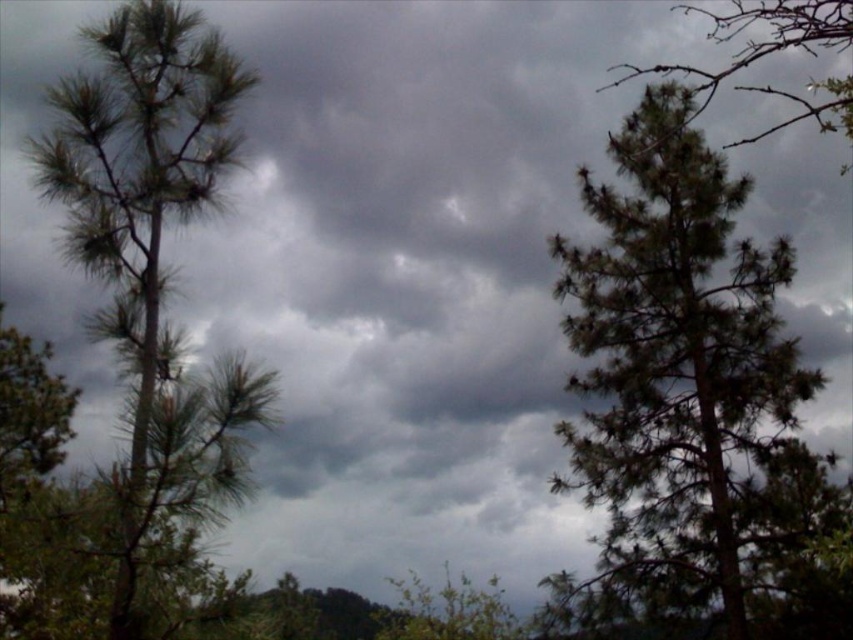
Between green needle-like at left and green needle-like at upper right, which one is positioned lower?

green needle-like at left

Which is behind, point (165, 68) or point (734, 22)?

Positioned behind is point (734, 22).

Describe the element at coordinates (140, 186) in the screenshot. I see `green needle-like at left` at that location.

At what (x,y) coordinates should I click in order to perform the action: click on green needle-like at left. Please return your answer as a coordinate pair (x, y). Looking at the image, I should click on (140, 186).

What do you see at coordinates (683, 381) in the screenshot? Image resolution: width=853 pixels, height=640 pixels. I see `green needle-like tree at right` at bounding box center [683, 381].

Can you confirm if green needle-like tree at right is positioned above green needle-like at upper right?

No, green needle-like tree at right is not above green needle-like at upper right.

Who is more distant from viewer, (756, 588) or (822, 19)?

The point (756, 588) is behind.

In order to click on green needle-like tree at right in this screenshot , I will do `click(683, 381)`.

Who is more distant from viewer, (665, 152) or (129, 106)?

Positioned behind is point (665, 152).

This screenshot has height=640, width=853. What are the coordinates of `green needle-like tree at right` in the screenshot? It's located at (683, 381).